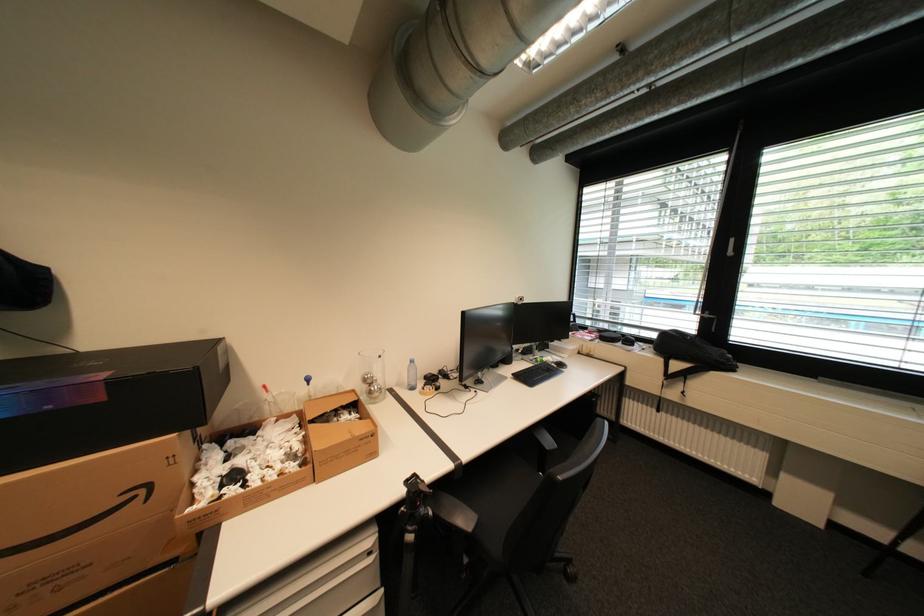
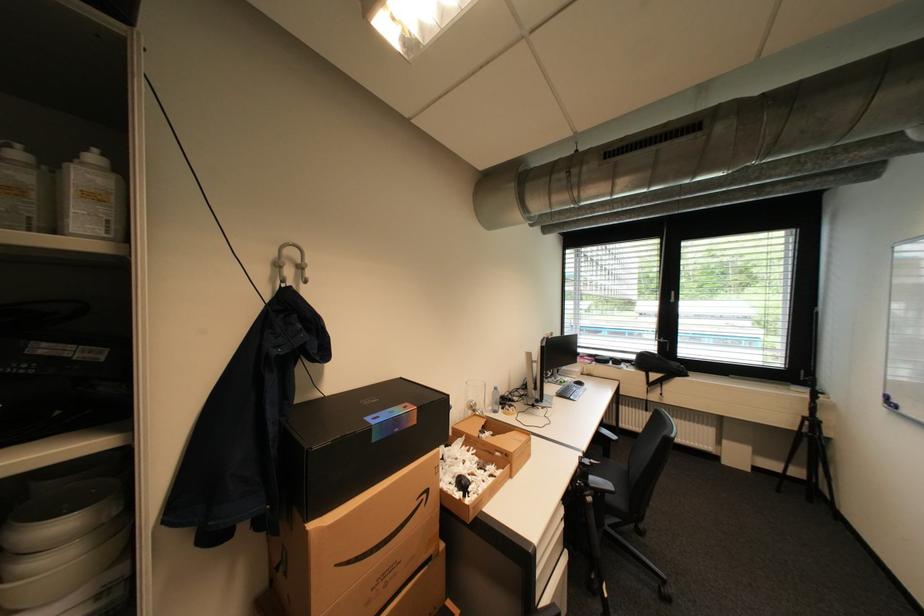
In the second image, find the point that corresponds to (375,376) in the first image.

(480, 402)